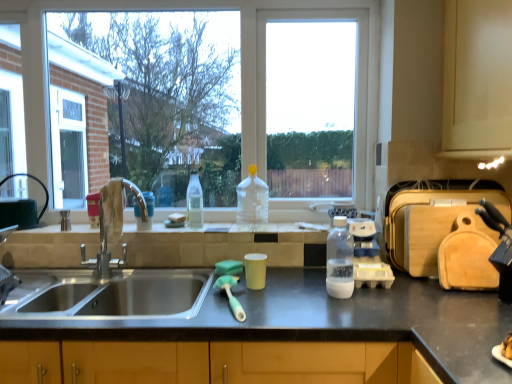
Question: From a real-world perspective, is wooden cutting board at right, which is the second appliance from left to right, positioned over clear glass screen door at left based on gravity?

Choices:
 (A) yes
 (B) no

Answer: (B)

Question: Considering the relative positions of wooden cutting board at right, which is the second appliance from left to right, and clear glass screen door at left in the image provided, is wooden cutting board at right, which is the second appliance from left to right, behind clear glass screen door at left?

Choices:
 (A) yes
 (B) no

Answer: (B)

Question: Does wooden cutting board at right, which is the second appliance from left to right, have a larger size compared to clear glass screen door at left?

Choices:
 (A) no
 (B) yes

Answer: (A)

Question: Is wooden cutting board at right, which ranks as the first appliance in right-to-left order, completely or partially outside of clear glass screen door at left?

Choices:
 (A) no
 (B) yes

Answer: (B)

Question: Is wooden cutting board at right, which ranks as the first appliance in right-to-left order, not near clear glass screen door at left?

Choices:
 (A) no
 (B) yes

Answer: (B)

Question: Considering the positions of wooden cutting board at right, which ranks as the first appliance in right-to-left order, and transparent plastic bottle at center, the 2th bottle when ordered from back to front, in the image, is wooden cutting board at right, which ranks as the first appliance in right-to-left order, wider or thinner than transparent plastic bottle at center, the 2th bottle when ordered from back to front,?

Choices:
 (A) wide
 (B) thin

Answer: (A)

Question: Is wooden cutting board at right, which ranks as the first appliance in right-to-left order, inside or outside of transparent plastic bottle at center, which ranks as the second bottle in front-to-back order?

Choices:
 (A) outside
 (B) inside

Answer: (A)

Question: From the image's perspective, relative to transparent plastic bottle at center, the 2th bottle when ordered from back to front, is wooden cutting board at right, which is the second appliance from left to right, above or below?

Choices:
 (A) below
 (B) above

Answer: (A)

Question: Is wooden cutting board at right, which ranks as the first appliance in right-to-left order, taller or shorter than transparent plastic bottle at center, placed as the 2th bottle when sorted from left to right?

Choices:
 (A) tall
 (B) short

Answer: (A)

Question: Is transparent plastic bottle at center, the first bottle positioned from the right, inside the boundaries of clear plastic bottle at center, acting as the first bottle starting from the back, or outside?

Choices:
 (A) outside
 (B) inside

Answer: (A)

Question: From the image's perspective, is transparent plastic bottle at center, the 3th bottle when ordered from back to front, positioned above or below clear plastic bottle at center, marked as the 3th bottle in a front-to-back arrangement?

Choices:
 (A) above
 (B) below

Answer: (B)

Question: Considering their positions, is transparent plastic bottle at center, the first bottle positioned from the right, located in front of or behind clear plastic bottle at center, which appears as the 3th bottle when viewed from the right?

Choices:
 (A) behind
 (B) front

Answer: (B)

Question: Looking at their shapes, would you say transparent plastic bottle at center, which is the 1th bottle from front to back, is wider or thinner than clear plastic bottle at center, which appears as the 3th bottle when viewed from the right?

Choices:
 (A) thin
 (B) wide

Answer: (B)

Question: From a real-world perspective, is clear plastic bottle at center, acting as the first bottle starting from the back, above or below clear glass screen door at left?

Choices:
 (A) below
 (B) above

Answer: (A)

Question: Relative to clear glass screen door at left, is clear plastic bottle at center, which appears as the 3th bottle when viewed from the right, in front or behind?

Choices:
 (A) behind
 (B) front

Answer: (B)